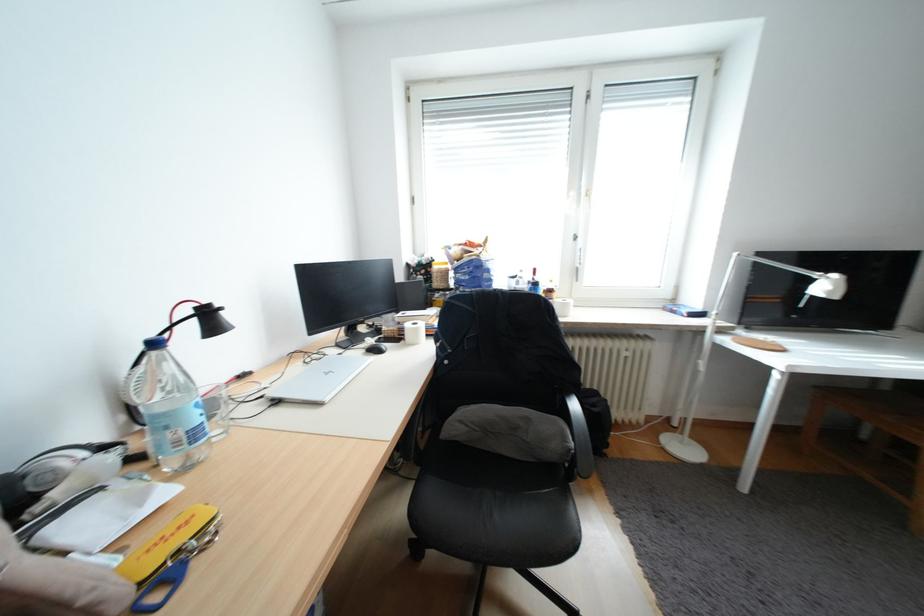
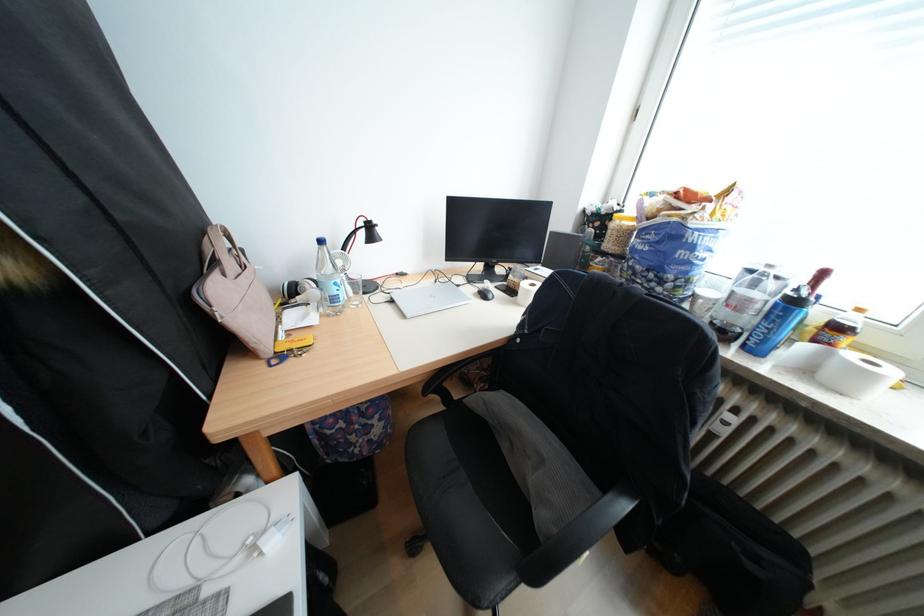
Locate, in the second image, the point that corresponds to (x=128, y=484) in the first image.

(325, 306)